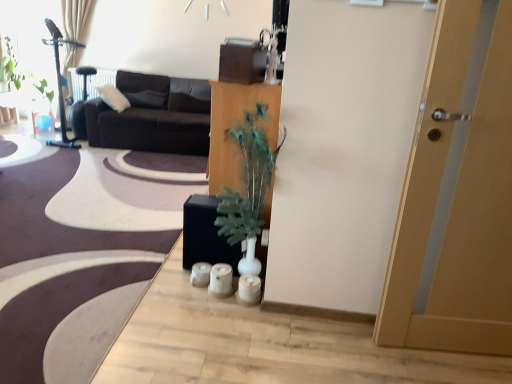
Question: Can you confirm if dark brown fabric couch at upper left is wider than green leafy plant at upper left?

Choices:
 (A) no
 (B) yes

Answer: (B)

Question: Does dark brown fabric couch at upper left have a greater height compared to green leafy plant at upper left?

Choices:
 (A) no
 (B) yes

Answer: (B)

Question: Is the depth of dark brown fabric couch at upper left less than that of green leafy plant at upper left?

Choices:
 (A) yes
 (B) no

Answer: (A)

Question: Is dark brown fabric couch at upper left outside green leafy plant at upper left?

Choices:
 (A) yes
 (B) no

Answer: (A)

Question: Considering the relative sizes of dark brown fabric couch at upper left and green leafy plant at upper left in the image provided, is dark brown fabric couch at upper left bigger than green leafy plant at upper left?

Choices:
 (A) yes
 (B) no

Answer: (A)

Question: From a real-world perspective, is green leafy plant at upper left physically located above or below transparent glass window screen at upper left?

Choices:
 (A) above
 (B) below

Answer: (B)

Question: In terms of height, does green leafy plant at upper left look taller or shorter compared to transparent glass window screen at upper left?

Choices:
 (A) short
 (B) tall

Answer: (A)

Question: Choose the correct answer: Is green leafy plant at upper left inside transparent glass window screen at upper left or outside it?

Choices:
 (A) outside
 (B) inside

Answer: (A)

Question: Considering the positions of green leafy plant at upper left and transparent glass window screen at upper left in the image, is green leafy plant at upper left bigger or smaller than transparent glass window screen at upper left?

Choices:
 (A) small
 (B) big

Answer: (A)

Question: Considering the positions of transparent glass window screen at upper left and wooden cabinet at center in the image, is transparent glass window screen at upper left taller or shorter than wooden cabinet at center?

Choices:
 (A) short
 (B) tall

Answer: (B)

Question: From a real-world perspective, is transparent glass window screen at upper left above or below wooden cabinet at center?

Choices:
 (A) below
 (B) above

Answer: (B)

Question: Which is correct: transparent glass window screen at upper left is inside wooden cabinet at center, or outside of it?

Choices:
 (A) outside
 (B) inside

Answer: (A)

Question: Is transparent glass window screen at upper left wider or thinner than wooden cabinet at center?

Choices:
 (A) wide
 (B) thin

Answer: (B)

Question: From a real-world perspective, relative to wooden cabinet at center, is dark brown fabric couch at upper left vertically above or below?

Choices:
 (A) above
 (B) below

Answer: (B)

Question: In the image, is dark brown fabric couch at upper left positioned in front of or behind wooden cabinet at center?

Choices:
 (A) front
 (B) behind

Answer: (B)